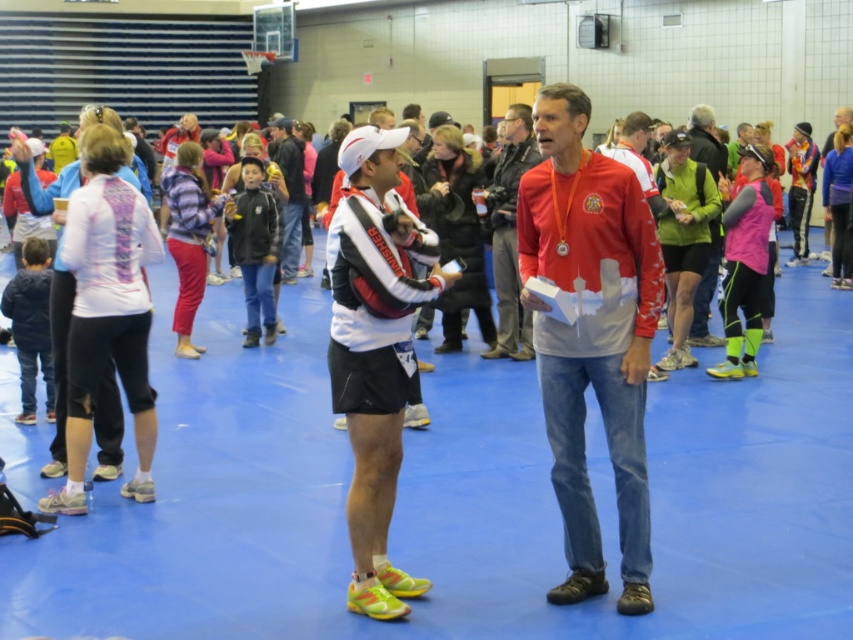
Who is shorter, pink fabric at center or dark blue jeans at center?

pink fabric at center

Is pink fabric at center closer to camera compared to dark blue jeans at center?

Yes, it is in front of dark blue jeans at center.

Describe the element at coordinates (706, 292) in the screenshot. I see `pink fabric at center` at that location.

Where is `pink fabric at center`? The image size is (853, 640). pink fabric at center is located at coordinates (706, 292).

Does matte red shirt at center have a lesser height compared to dark blue jeans at center?

Yes.

Can you confirm if matte red shirt at center is positioned below dark blue jeans at center?

Yes.

Which is behind, point (606, 282) or point (276, 154)?

The point (276, 154) is behind.

Where is `matte red shirt at center`? matte red shirt at center is located at coordinates [x=590, y=336].

Between matte red shirt at center and pink fabric at center, which one appears on the right side from the viewer's perspective?

From the viewer's perspective, pink fabric at center appears more on the right side.

What do you see at coordinates (590, 336) in the screenshot?
I see `matte red shirt at center` at bounding box center [590, 336].

Identify the location of matte red shirt at center. (590, 336).